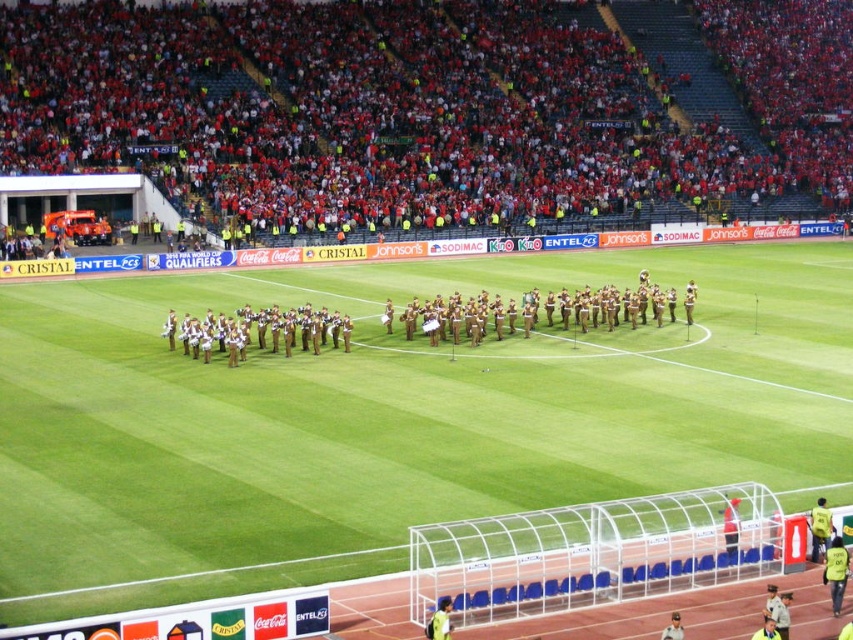
Question: Is red fabric crowd at upper center thinner than brown uniformed band at center?

Choices:
 (A) no
 (B) yes

Answer: (A)

Question: Which of the following is the farthest from the observer?

Choices:
 (A) green grass football field at center
 (B) brown uniformed band at center
 (C) red fabric crowd at upper center

Answer: (C)

Question: Which object is closer to the camera taking this photo?

Choices:
 (A) green grass football field at center
 (B) red fabric crowd at upper center
 (C) brown uniformed band at center

Answer: (A)

Question: Can you confirm if green grass football field at center is bigger than red fabric crowd at upper center?

Choices:
 (A) no
 (B) yes

Answer: (A)

Question: In this image, where is green grass football field at center located relative to red fabric crowd at upper center?

Choices:
 (A) above
 (B) below

Answer: (B)

Question: Based on their relative distances, which object is farther from the brown uniformed band at center?

Choices:
 (A) red fabric crowd at upper center
 (B) green grass football field at center

Answer: (A)